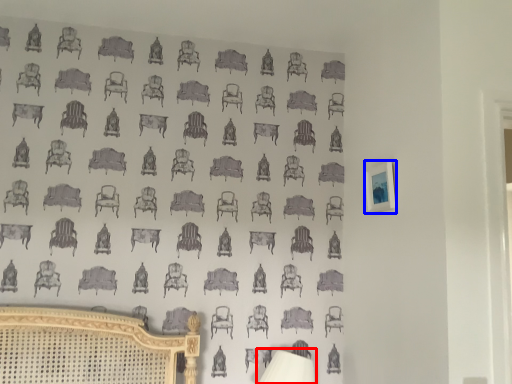
Question: Which of the following is the closest to the observer, table lamp (highlighted by a red box) or picture frame (highlighted by a blue box)?

Choices:
 (A) table lamp
 (B) picture frame

Answer: (B)